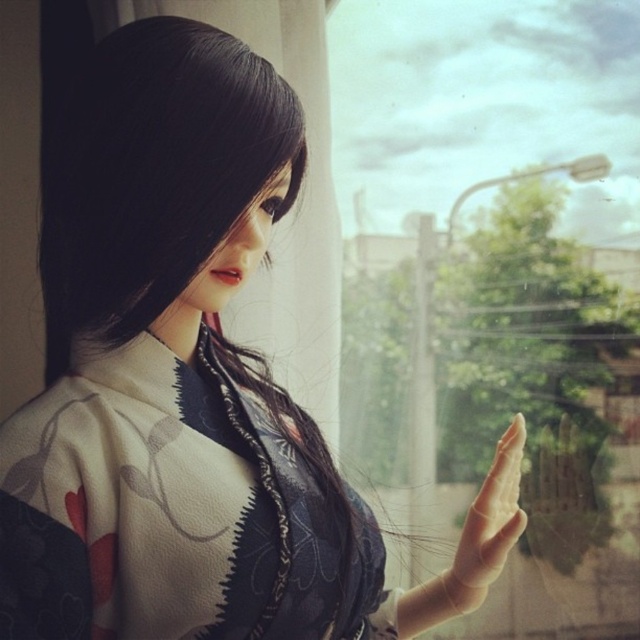
You are standing in the room where the person in the kimono is. You want to look outside through the transparent glass window at center. Where should you go to see the outdoor view?

You should go to the transparent glass window at center located at point [497,285] to see the outdoor view.

You are a photographer trying to capture the view outside through the transparent glass window at center while holding your smooth skin hand at center near it. Can you fit both the entire window and your hand in the frame without moving either?

The transparent glass window at center is bigger than the smooth skin hand at center, so yes, you can fit both the entire window and your hand in the frame without moving either because the window is larger and can accommodate the smaller hand within its size.

You are an artist sketching the scene and want to ensure proportions are accurate. Given the white silk kimono at center and the smooth skin hand at center, which one should you draw first to maintain proper scale?

The white silk kimono at center is taller than the smooth skin hand at center, so you should draw the white silk kimono at center first to establish the correct scale before adding the smaller hand.